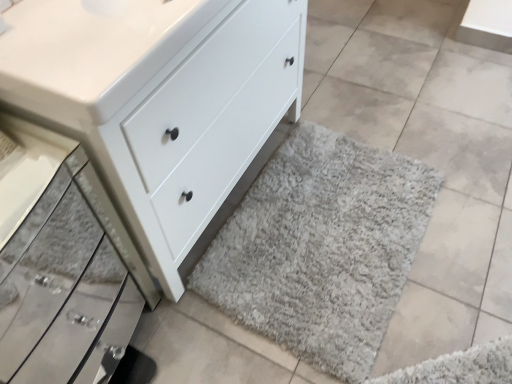
The height and width of the screenshot is (384, 512). In order to click on vacant area on top of gray shaggy rug at lower right (from a real-world perspective) in this screenshot , I will do `click(325, 226)`.